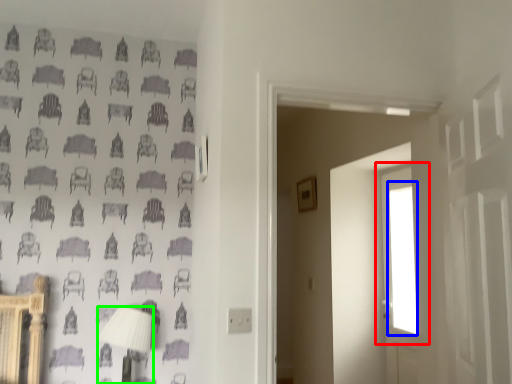
Question: Which is farther away from window (highlighted by a red box)? window (highlighted by a blue box) or table lamp (highlighted by a green box)?

Choices:
 (A) window
 (B) table lamp

Answer: (B)